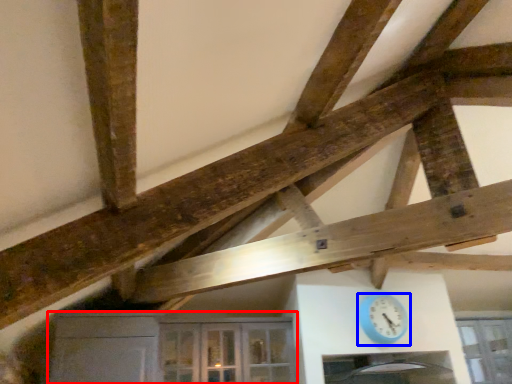
Question: Which object appears closest to the camera in this image, cabinetry (highlighted by a red box) or clock (highlighted by a blue box)?

Choices:
 (A) cabinetry
 (B) clock

Answer: (A)